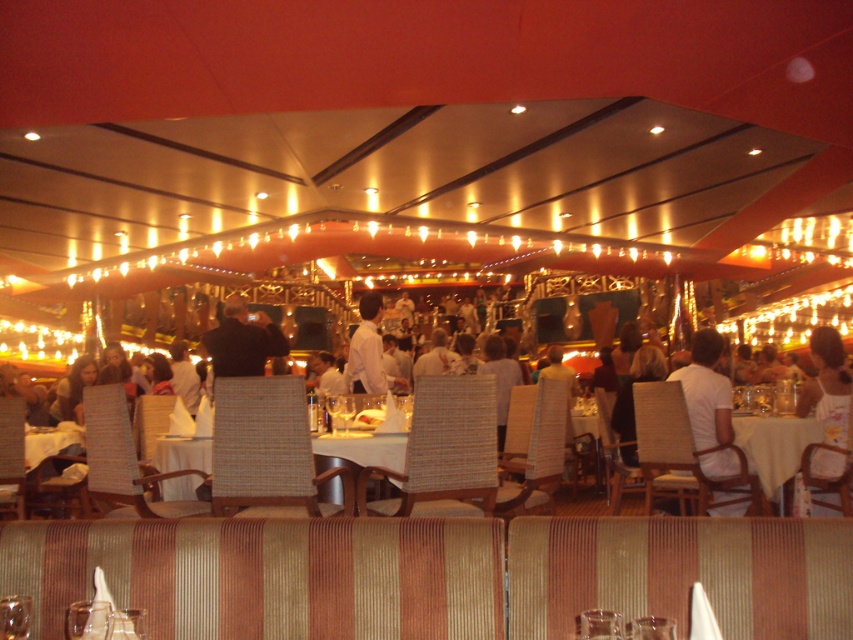
Who is taller, yellow fabric table at center or white shirt at center?

white shirt at center

Is yellow fabric table at center bigger than white shirt at center?

Yes, yellow fabric table at center is bigger than white shirt at center.

Is point (764, 432) positioned before point (376, 305)?

That is True.

In order to click on yellow fabric table at center in this screenshot , I will do pyautogui.click(x=775, y=445).

Can you confirm if white floral dress at center is smaller than yellow fabric table at center?

Actually, white floral dress at center might be larger than yellow fabric table at center.

Can you confirm if white floral dress at center is taller than yellow fabric table at center?

Yes.

At what (x,y) coordinates should I click in order to perform the action: click on white floral dress at center. Please return your answer as a coordinate pair (x, y). Looking at the image, I should click on (827, 387).

Can you confirm if white matte shirt at center is smaller than white floral dress at center?

Correct, white matte shirt at center occupies less space than white floral dress at center.

Between point (694, 385) and point (830, 412), which one is positioned in front?

Point (830, 412) is more forward.

The width and height of the screenshot is (853, 640). I want to click on white matte shirt at center, so click(x=706, y=392).